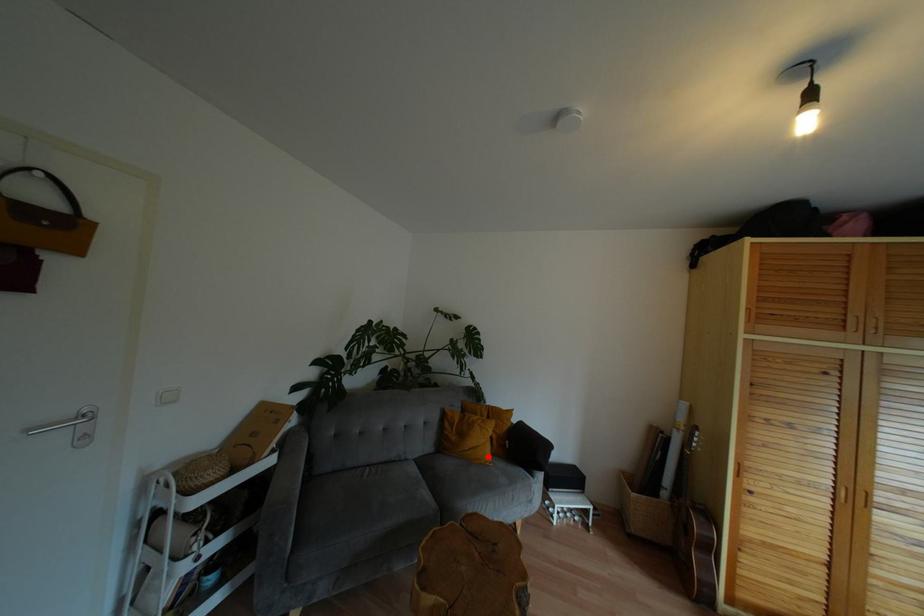
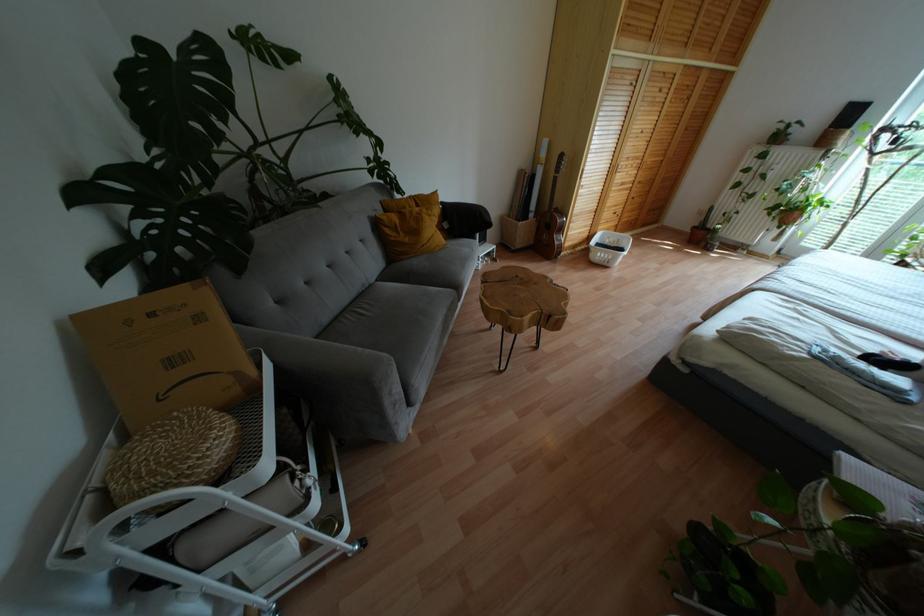
The point at the highlighted location is marked in the first image. Where is the corresponding point in the second image?

(443, 240)